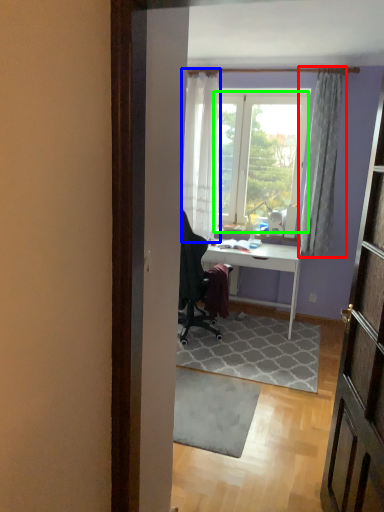
Question: Estimate the real-world distances between objects in this image. Which object is closer to curtain (highlighted by a red box), curtain (highlighted by a blue box) or window screen (highlighted by a green box)?

Choices:
 (A) curtain
 (B) window screen

Answer: (B)